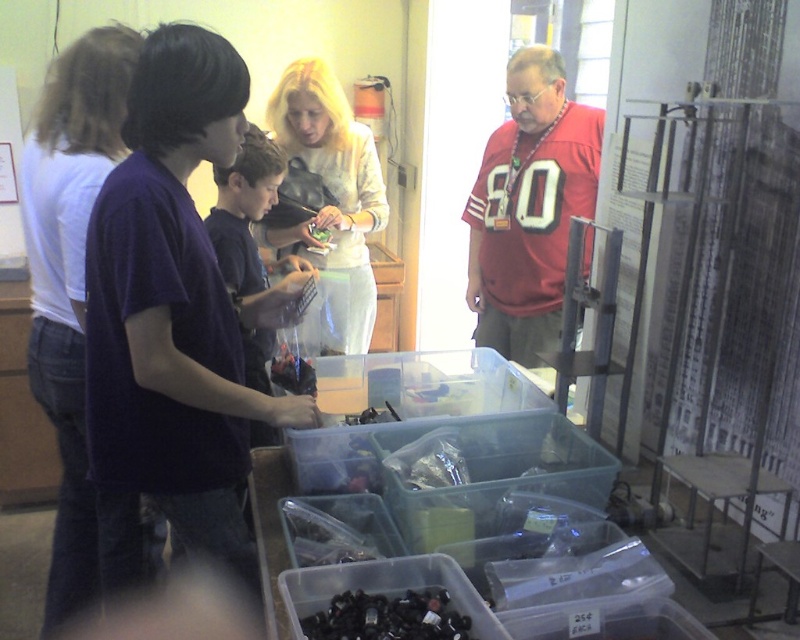
Question: Which point appears farthest from the camera in this image?

Choices:
 (A) (61, 394)
 (B) (300, 141)

Answer: (B)

Question: Which object is closer to the camera taking this photo?

Choices:
 (A) purple cotton shirt at left
 (B) red jersey at center

Answer: (A)

Question: Is black plastic bottle at lower center bigger than green matte vegetable at center?

Choices:
 (A) yes
 (B) no

Answer: (A)

Question: Does white cotton shirt at left appear on the left side of black plastic bottle at lower center?

Choices:
 (A) no
 (B) yes

Answer: (B)

Question: Which point appears closest to the camera in this image?

Choices:
 (A) (498, 150)
 (B) (277, 132)
 (C) (380, 634)
 (D) (324, 236)

Answer: (C)

Question: Can you confirm if black plastic bottle at lower center is positioned above green matte vegetable at center?

Choices:
 (A) no
 (B) yes

Answer: (A)